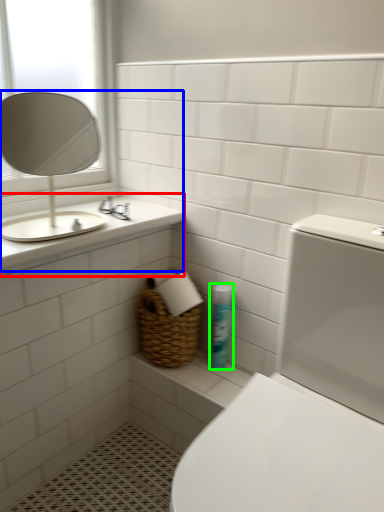
Question: Which object is positioned closest to counter top (highlighted by a red box)? Select from sink (highlighted by a blue box) and cleaning product (highlighted by a green box).

Choices:
 (A) sink
 (B) cleaning product

Answer: (B)